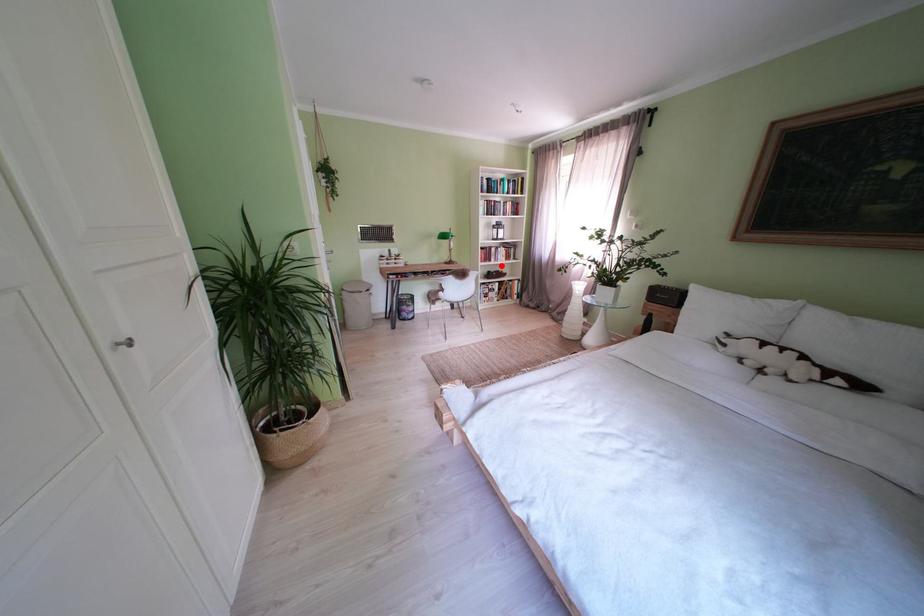
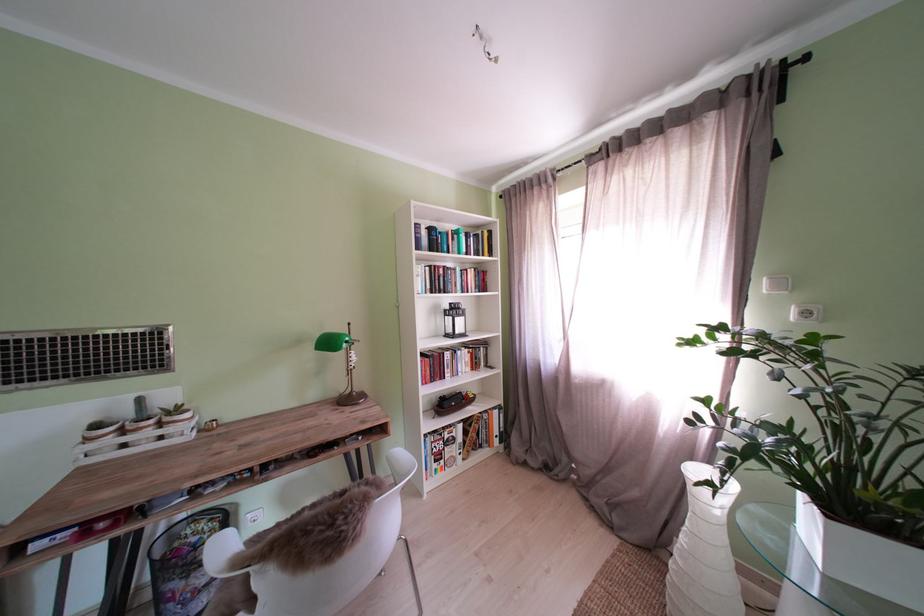
Locate, in the second image, the point that corresponds to the highlighted location in the first image.

(454, 382)